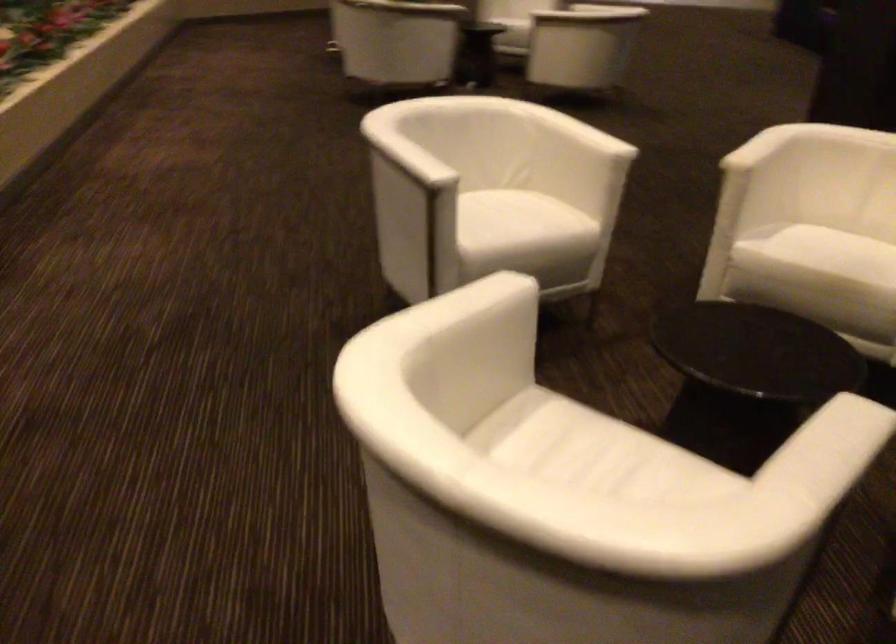
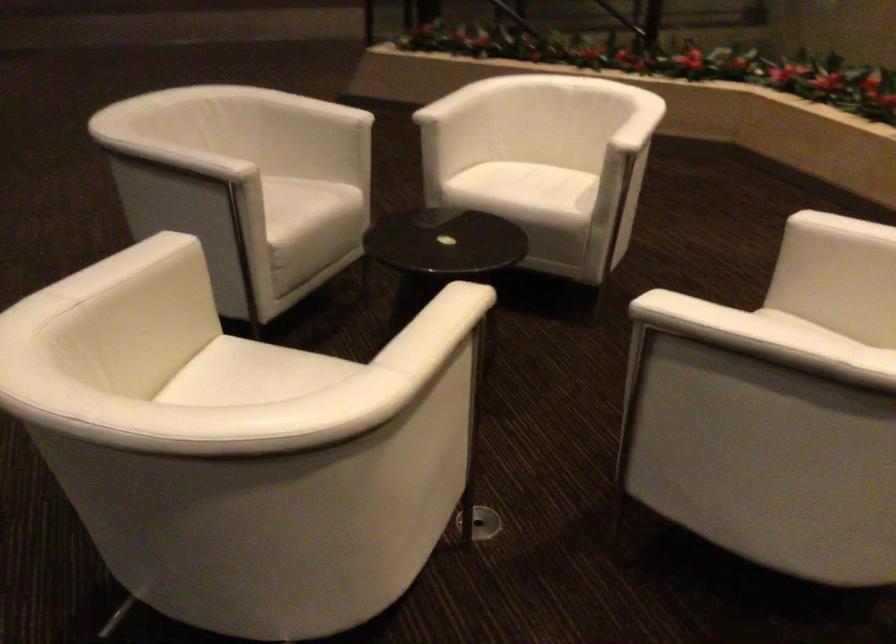
Locate, in the second image, the point that corresponds to the point at 746,484 in the first image.

(469, 89)